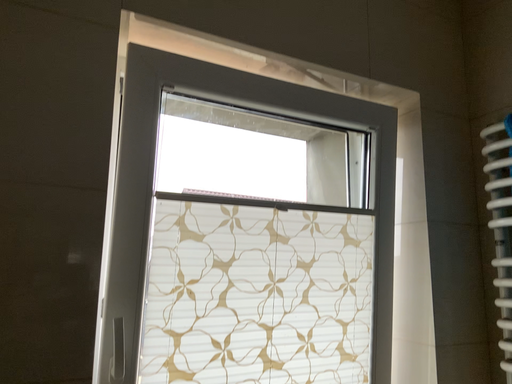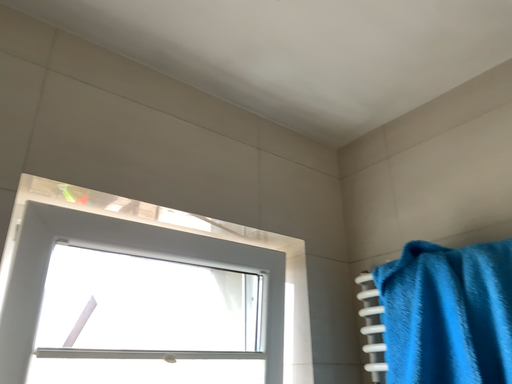
Question: Which way did the camera rotate in the video?

Choices:
 (A) rotated downward
 (B) rotated upward

Answer: (B)